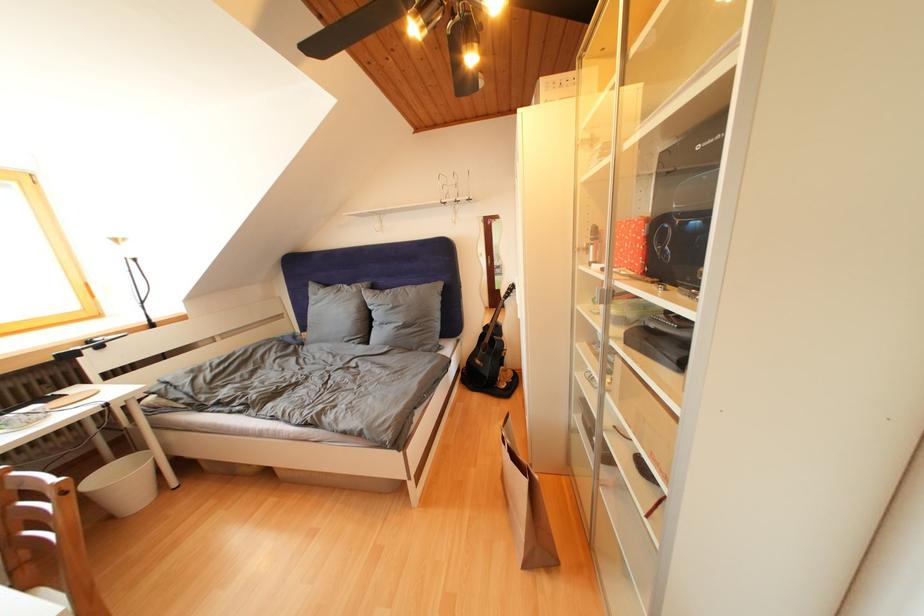
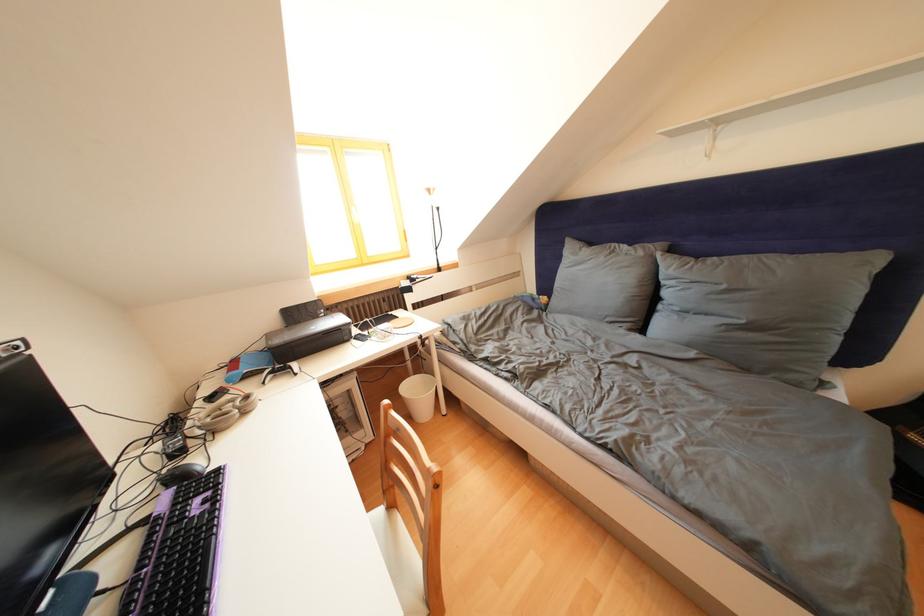
Locate, in the second image, the point that corresponds to [398,310] in the first image.

(733, 292)